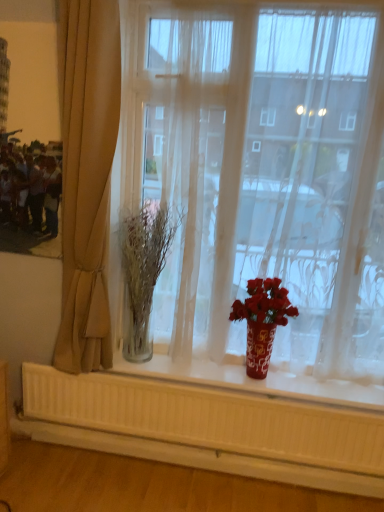
Question: Is beige fabric curtain at left placed right next to transparent glass vase at center?

Choices:
 (A) no
 (B) yes

Answer: (A)

Question: Does beige fabric curtain at left have a lesser height compared to transparent glass vase at center?

Choices:
 (A) yes
 (B) no

Answer: (A)

Question: From a real-world perspective, is beige fabric curtain at left on top of transparent glass vase at center?

Choices:
 (A) no
 (B) yes

Answer: (A)

Question: Would you say beige fabric curtain at left is a long distance from transparent glass vase at center?

Choices:
 (A) no
 (B) yes

Answer: (A)

Question: Is beige fabric curtain at left bigger than transparent glass vase at center?

Choices:
 (A) yes
 (B) no

Answer: (B)

Question: Is beige fabric curtain at left bigger or smaller than clear glass vase at center?

Choices:
 (A) big
 (B) small

Answer: (A)

Question: From the image's perspective, is beige fabric curtain at left positioned above or below clear glass vase at center?

Choices:
 (A) below
 (B) above

Answer: (B)

Question: Is point (66, 76) positioned closer to the camera than point (145, 332)?

Choices:
 (A) farther
 (B) closer

Answer: (B)

Question: In terms of height, does beige fabric curtain at left look taller or shorter compared to clear glass vase at center?

Choices:
 (A) tall
 (B) short

Answer: (A)

Question: Is transparent glass vase at center in front of or behind shiny red vase at center in the image?

Choices:
 (A) front
 (B) behind

Answer: (A)

Question: In terms of height, does transparent glass vase at center look taller or shorter compared to shiny red vase at center?

Choices:
 (A) tall
 (B) short

Answer: (A)

Question: Does point (312, 269) appear closer or farther from the camera than point (261, 328)?

Choices:
 (A) farther
 (B) closer

Answer: (A)

Question: Is transparent glass vase at center to the left or to the right of shiny red vase at center in the image?

Choices:
 (A) right
 (B) left

Answer: (A)

Question: Is shiny red vase at center wider or thinner than beige fabric curtain at left?

Choices:
 (A) wide
 (B) thin

Answer: (B)

Question: Considering the positions of shiny red vase at center and beige fabric curtain at left in the image, is shiny red vase at center taller or shorter than beige fabric curtain at left?

Choices:
 (A) tall
 (B) short

Answer: (B)